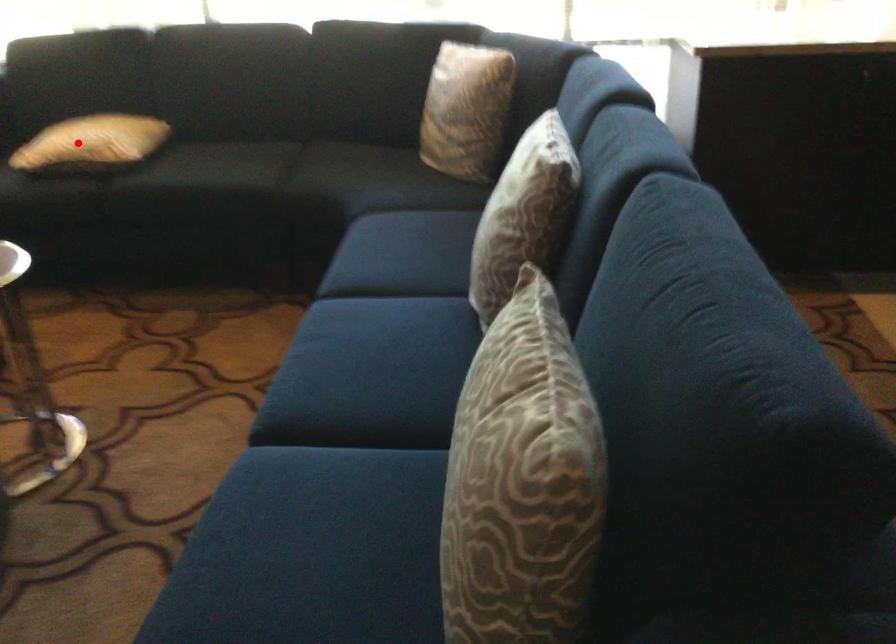
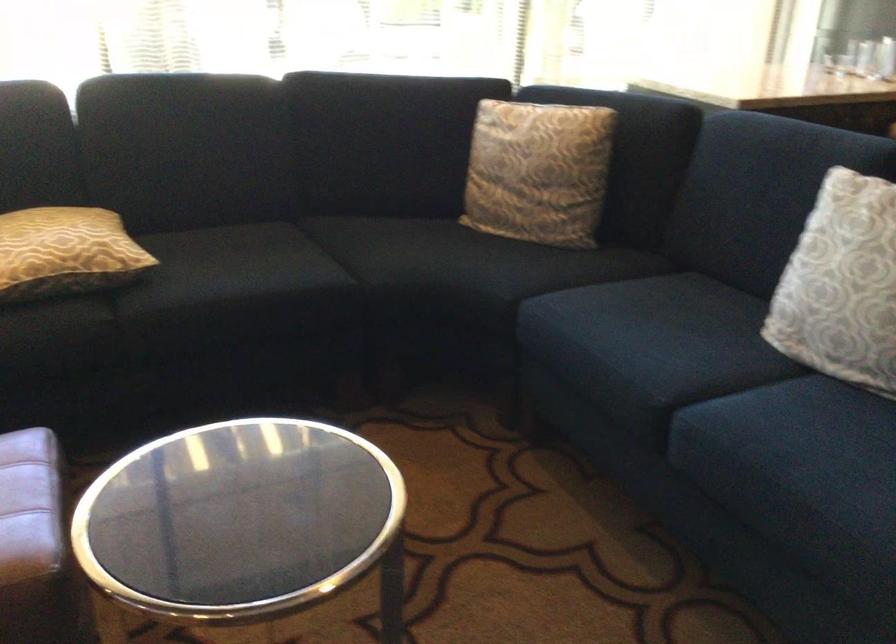
Locate, in the second image, the point that corresponds to the highlighted location in the first image.

(65, 252)